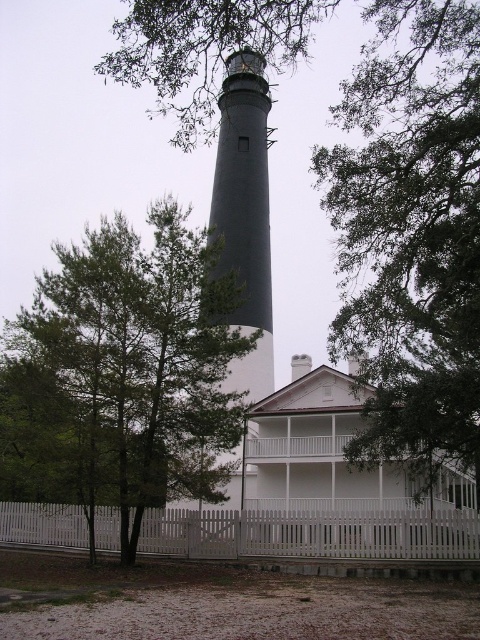
Who is positioned more to the left, green leafy tree at center or dark gray concrete lighthouse at center?

Positioned to the left is dark gray concrete lighthouse at center.

Which is in front, point (419, 272) or point (245, 161)?

Point (419, 272)

I want to click on green leafy tree at center, so click(x=411, y=228).

The height and width of the screenshot is (640, 480). What are the coordinates of `green leafy tree at center` in the screenshot? It's located at (411, 228).

Between green leafy tree at center and green leafy tree at left, which one appears on the left side from the viewer's perspective?

green leafy tree at left is more to the left.

Is point (422, 333) closer to viewer compared to point (54, 307)?

Yes, it is in front of point (54, 307).

Where is `green leafy tree at center`? This screenshot has height=640, width=480. green leafy tree at center is located at coordinates (411, 228).

Between point (100, 499) and point (97, 513), which one is positioned in front?

Positioned in front is point (100, 499).

Does green leafy tree at left have a lesser width compared to white picket fence at lower center?

Incorrect, green leafy tree at left's width is not less than white picket fence at lower center's.

You are a GUI agent. You are given a task and a screenshot of the screen. Output one action in this format:
    pyautogui.click(x=<x>, y=<y>)
    Task: Click on the green leafy tree at left
    The image size is (480, 640).
    Given the screenshot: What is the action you would take?
    pyautogui.click(x=123, y=376)

I want to click on green leafy tree at left, so click(123, 376).